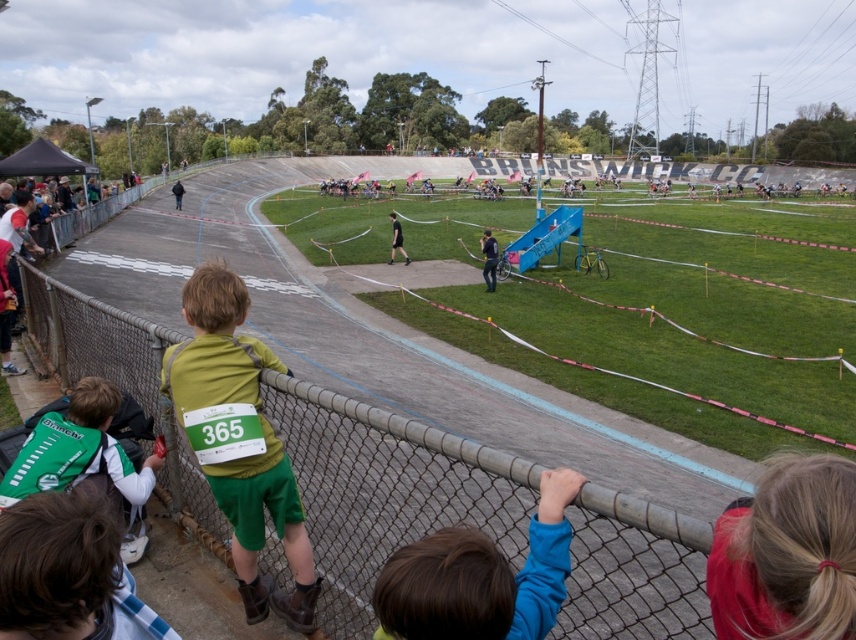
Question: Is blonde hair at upper right positioned before dark blue jacket at center?

Choices:
 (A) yes
 (B) no

Answer: (A)

Question: Which point is farther to the camera?

Choices:
 (A) (122, 467)
 (B) (791, 518)
 (C) (539, 552)

Answer: (A)

Question: Does dark blue jeans at center have a larger size compared to dark blue jacket at center?

Choices:
 (A) no
 (B) yes

Answer: (A)

Question: Among these objects, which one is nearest to the camera?

Choices:
 (A) green matte shorts at left
 (B) blue fleece at lower center

Answer: (B)

Question: Is the position of blonde hair at upper right less distant than that of blue fleece at lower center?

Choices:
 (A) yes
 (B) no

Answer: (A)

Question: Which point is closer to the camera taking this photo?

Choices:
 (A) (435, 564)
 (B) (123, 484)
 (C) (247, 486)
 (D) (357, 426)

Answer: (A)